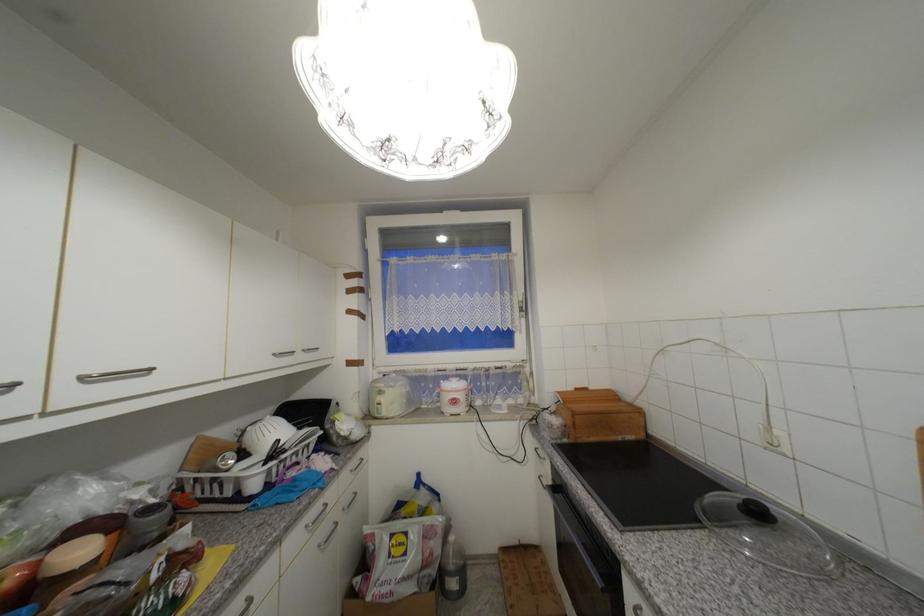
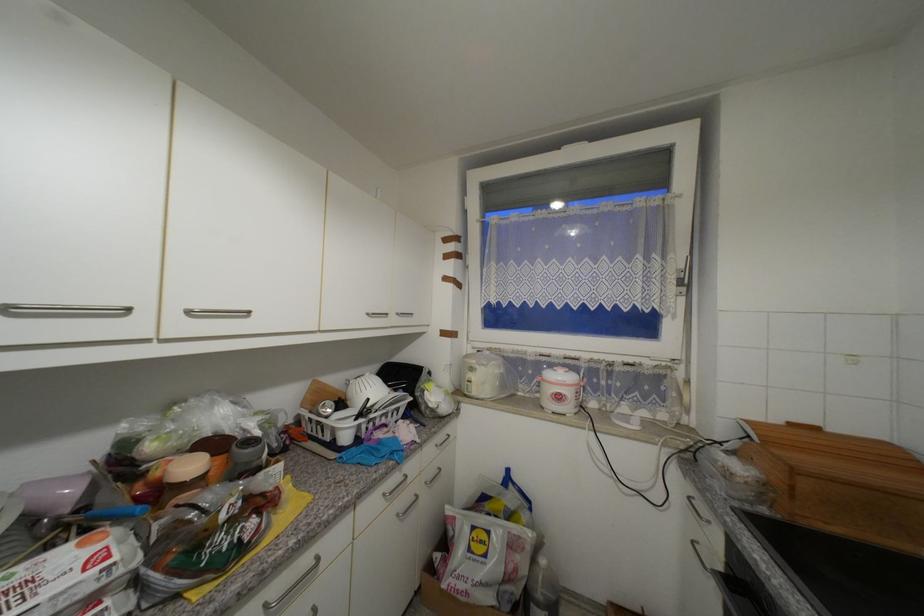
Question: Based on the continuous images, in which direction is the camera rotating? Reply with the corresponding letter.

Choices:
 (A) Left
 (B) Right
 (C) Up
 (D) Down

Answer: (A)